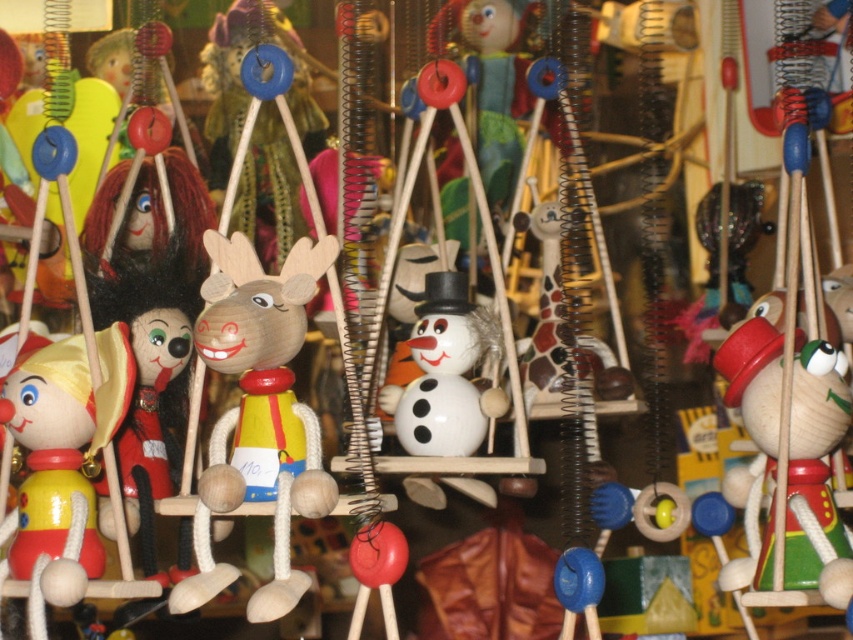
You are a visitor at the marionette display and want to take a photo of both the wooden clown at center and the matte yellow wood clown at left. Since you can only focus on one at a time, which one should you position closer to the camera to ensure it appears larger in your photo?

To make the wooden clown at center appear larger in the photo, position it closer to the camera since it is already to the right of the matte yellow wood clown at left, meaning it is closer to the viewer.

Consider the image. You are a toy collector examining the marionettes in the display. You notice two wooden figures at the center of the display. Which one is taller between the wooden reindeer at center and the wooden clown at center?

The wooden reindeer at center is taller than the wooden clown at center.

In the scene shown: You are a photographer holding a camera. You want to take a photo of the wooden reindeer at center from a distance that allows you to capture it clearly without distortion. Given that the recommended distance for such a camera is 1.06 meters, is the current distance suitable?

The wooden reindeer at center and camera are 1.06 meters apart, so the current distance is exactly the recommended 1.06 meters. This means the photographer can take a clear photo without distortion.